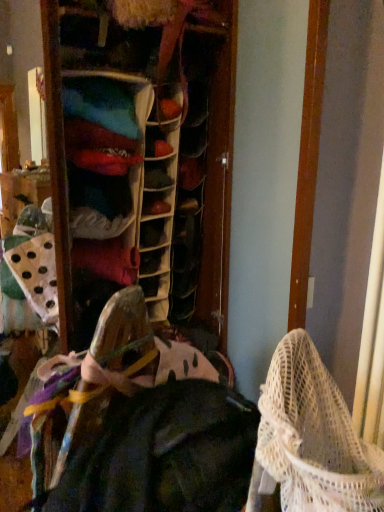
Question: From a real-world perspective, is dark green fabric at center positioned above or below white mesh baby carriage at lower right?

Choices:
 (A) below
 (B) above

Answer: (A)

Question: From the image's perspective, is dark green fabric at center above or below white mesh baby carriage at lower right?

Choices:
 (A) below
 (B) above

Answer: (A)

Question: Considering the positions of dark green fabric at center and white mesh baby carriage at lower right in the image, is dark green fabric at center taller or shorter than white mesh baby carriage at lower right?

Choices:
 (A) short
 (B) tall

Answer: (B)

Question: Considering the positions of white mesh baby carriage at lower right and dark green fabric at center in the image, is white mesh baby carriage at lower right wider or thinner than dark green fabric at center?

Choices:
 (A) thin
 (B) wide

Answer: (A)

Question: Looking at the image, does white mesh baby carriage at lower right seem bigger or smaller compared to dark green fabric at center?

Choices:
 (A) big
 (B) small

Answer: (B)

Question: Would you say white mesh baby carriage at lower right is to the left or to the right of dark green fabric at center in the picture?

Choices:
 (A) left
 (B) right

Answer: (B)

Question: In terms of height, does white mesh baby carriage at lower right look taller or shorter compared to dark green fabric at center?

Choices:
 (A) short
 (B) tall

Answer: (A)